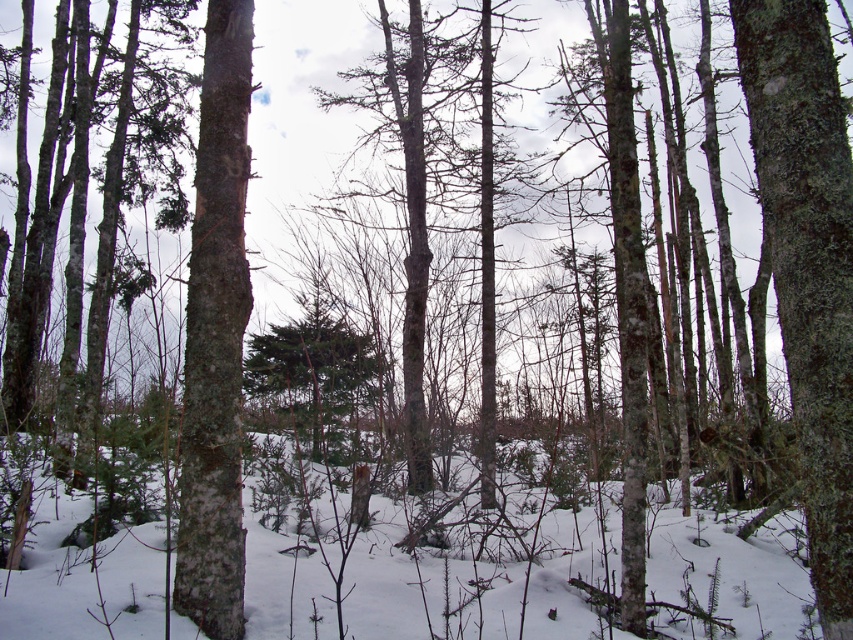
Question: Which point appears closest to the camera in this image?

Choices:
 (A) (830, 93)
 (B) (462, 602)

Answer: (A)

Question: Is white powdery snow at center to the left of smooth bark tree at center from the viewer's perspective?

Choices:
 (A) no
 (B) yes

Answer: (B)

Question: Does smooth bark tree at center appear over smooth white bark at center?

Choices:
 (A) no
 (B) yes

Answer: (A)

Question: Among these objects, which one is nearest to the camera?

Choices:
 (A) white powdery snow at center
 (B) smooth white bark at center

Answer: (B)

Question: Estimate the real-world distances between objects in this image. Which object is closer to the smooth white bark at center?

Choices:
 (A) smooth bark tree at center
 (B) white powdery snow at center

Answer: (B)

Question: Is white powdery snow at center closer to camera compared to smooth white bark at center?

Choices:
 (A) no
 (B) yes

Answer: (A)